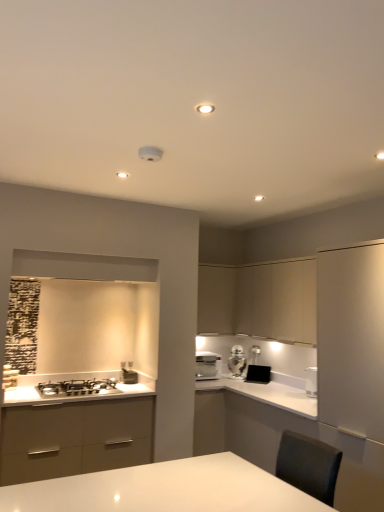
Question: In terms of height, does white glossy coffee machine at center look taller or shorter compared to white glossy toaster at upper center?

Choices:
 (A) tall
 (B) short

Answer: (B)

Question: Does point (198, 352) appear closer or farther from the camera than point (231, 361)?

Choices:
 (A) farther
 (B) closer

Answer: (B)

Question: Which of these objects is positioned closest to the white glossy coffee machine at center?

Choices:
 (A) metallic silver toaster at lower center, arranged as the 1th appliance when viewed from the front
 (B) matte beige cabinet at upper center, the first cabinetry from the left
 (C) satin silver gas stove at lower left
 (D) white glossy countertop at center
 (E) matte beige cabinet at upper right, which ranks as the 2th cabinetry in left-to-right order

Answer: (D)

Question: Which is farther from the white glossy toaster at upper center?

Choices:
 (A) black matte toaster at center, the second appliance from the left
 (B) satin silver gas stove at lower left
 (C) white glossy countertop at center
 (D) metallic silver toaster at lower center, which ranks as the first appliance in left-to-right order
 (E) matte beige cabinet at upper right, the 1th cabinetry positioned from the right

Answer: (B)